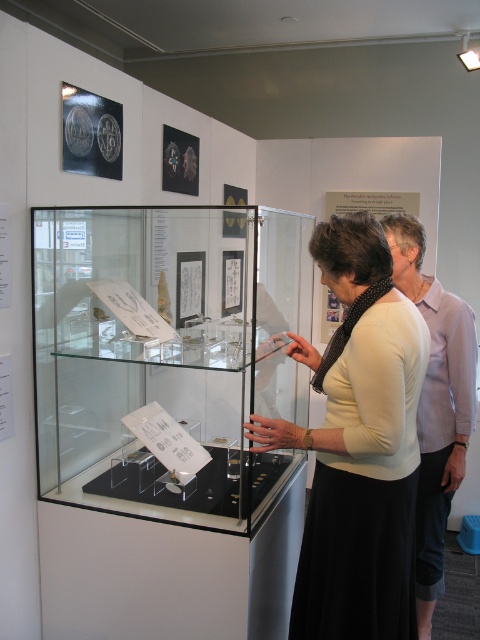
Question: Which point is farther from the camera taking this photo?

Choices:
 (A) tap(432, 300)
 (B) tap(108, 330)
 (C) tap(331, 259)

Answer: (A)

Question: In this image, where is clear glass case at center located relative to white matte sweater at center?

Choices:
 (A) above
 (B) below

Answer: (A)

Question: Which object is the closest to the white matte sweater at center?

Choices:
 (A) light purple shirt at right
 (B) clear glass case at center

Answer: (A)

Question: Which point is farther from the camera taking this photo?

Choices:
 (A) (245, 266)
 (B) (408, 344)

Answer: (A)

Question: Where is white matte sweater at center located in relation to light purple shirt at right in the image?

Choices:
 (A) right
 (B) left

Answer: (B)

Question: Can you confirm if clear glass case at center is wider than white matte sweater at center?

Choices:
 (A) no
 (B) yes

Answer: (B)